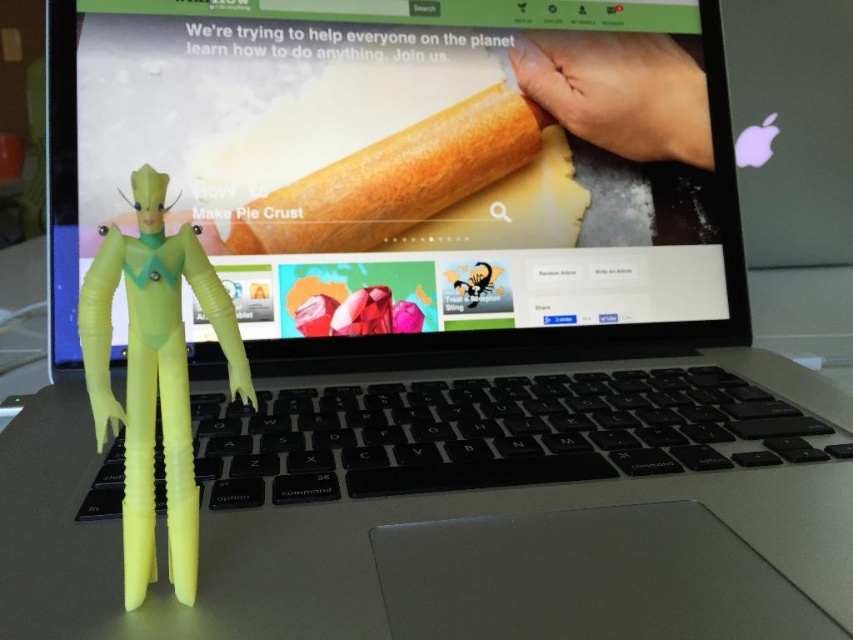
Question: Is matte plastic laptop at center above smooth skin hand at upper right?

Choices:
 (A) yes
 (B) no

Answer: (B)

Question: Is translucent yellow plastic figure at center positioned before smooth skin hand at upper right?

Choices:
 (A) no
 (B) yes

Answer: (B)

Question: Which object is closer to the camera taking this photo?

Choices:
 (A) white matte pie crust at upper center
 (B) matte plastic laptop at center

Answer: (B)

Question: Is black plastic keyboard at center to the left of translucent yellow plastic figure at center from the viewer's perspective?

Choices:
 (A) yes
 (B) no

Answer: (B)

Question: Which is nearer to the white matte pie crust at upper center?

Choices:
 (A) translucent yellow plastic figure at center
 (B) black plastic keyboard at center

Answer: (B)

Question: Which of the following is the farthest from the observer?

Choices:
 (A) (486, 272)
 (B) (575, 67)
 (C) (206, 216)
 (D) (196, 538)

Answer: (B)